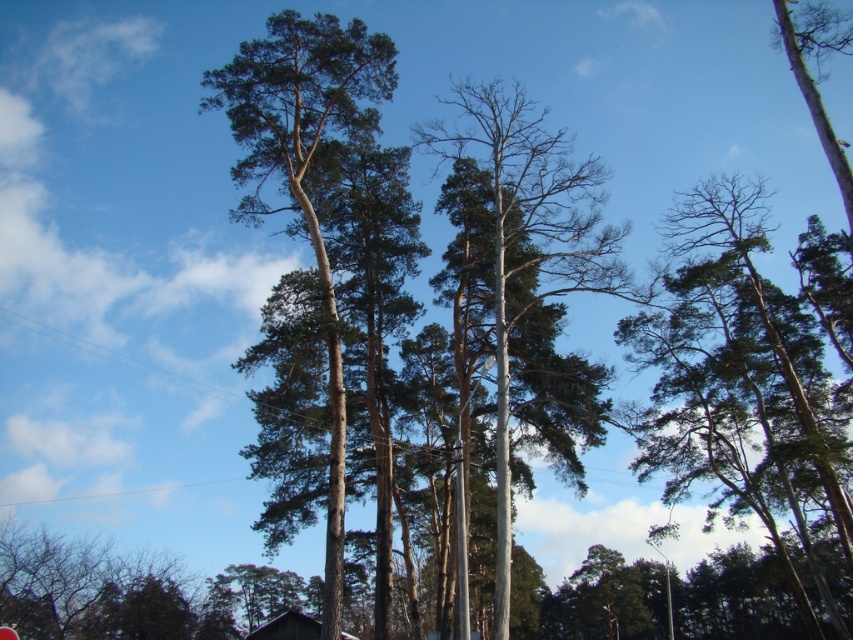
Question: Which point is farther to the camera?

Choices:
 (A) green-brown bark tree at center
 (B) smooth gray tree at center
 (C) green matte tree at upper right

Answer: (C)

Question: Considering the relative positions of green matte tree at upper right and green-brown bark tree at center in the image provided, where is green matte tree at upper right located with respect to green-brown bark tree at center?

Choices:
 (A) right
 (B) left

Answer: (A)

Question: Which object is the closest to the green matte tree at upper right?

Choices:
 (A) smooth gray tree at center
 (B) green-brown bark tree at center

Answer: (A)

Question: Which object is the closest to the smooth gray tree at center?

Choices:
 (A) green-brown bark tree at center
 (B) green matte tree at upper right

Answer: (A)

Question: Does green-brown bark tree at center appear on the left side of smooth gray tree at center?

Choices:
 (A) no
 (B) yes

Answer: (B)

Question: Observing the image, what is the correct spatial positioning of green matte tree at upper right in reference to green-brown bark tree at center?

Choices:
 (A) right
 (B) left

Answer: (A)